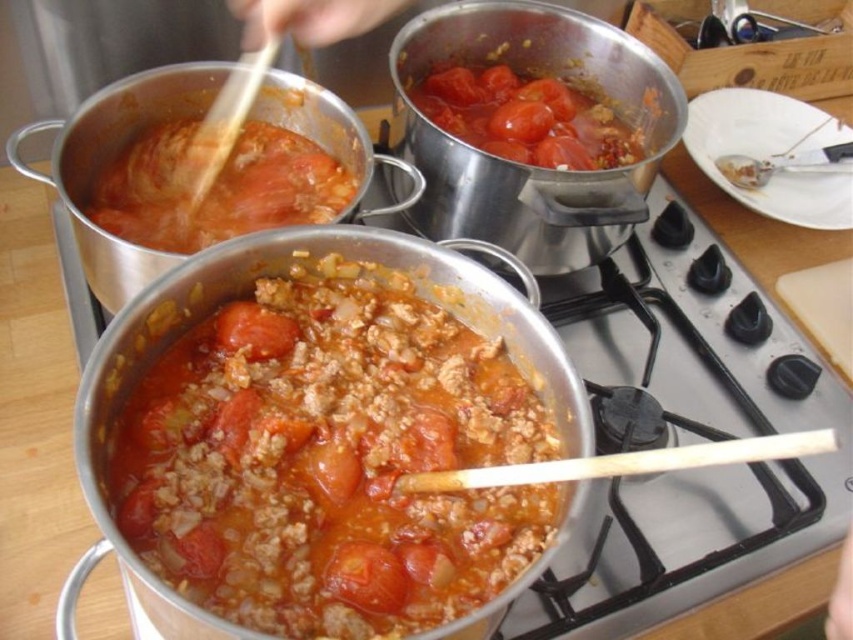
Is tomatoey paste at center thinner than stainless steel gas stove at center?

Indeed, tomatoey paste at center has a lesser width compared to stainless steel gas stove at center.

Based on the photo, is tomatoey paste at center to the left of stainless steel gas stove at center from the viewer's perspective?

Yes, tomatoey paste at center is to the left of stainless steel gas stove at center.

Locate an element on the screen. The image size is (853, 640). tomatoey paste at center is located at coordinates (334, 461).

Who is taller, tomatoey paste at center or tomato-based sauce at center?

With more height is tomatoey paste at center.

Does point (424, 376) come behind point (256, 228)?

No.

This screenshot has width=853, height=640. Identify the location of tomatoey paste at center. (334, 461).

This screenshot has width=853, height=640. What do you see at coordinates (679, 337) in the screenshot?
I see `stainless steel gas stove at center` at bounding box center [679, 337].

How distant is stainless steel gas stove at center from tomato-based sauce at center?

stainless steel gas stove at center is 12.98 inches away from tomato-based sauce at center.

Between point (706, 404) and point (231, 193), which one is positioned in front?

Point (231, 193) is more forward.

This screenshot has width=853, height=640. I want to click on stainless steel gas stove at center, so click(679, 337).